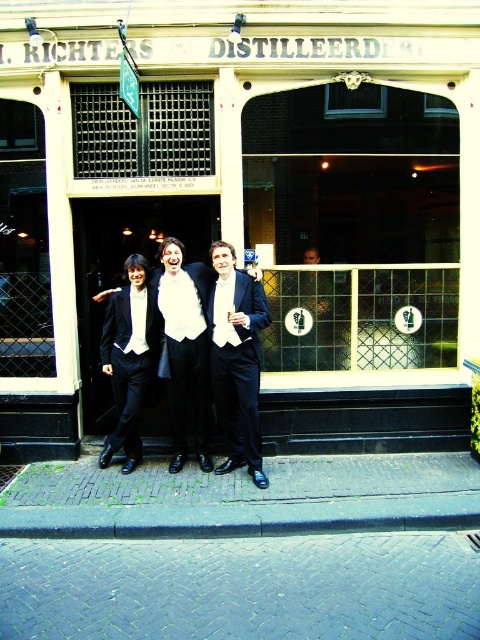
Question: Is shiny black suit at center smaller than matte black suit at center?

Choices:
 (A) no
 (B) yes

Answer: (A)

Question: Which point is farther from the camera taking this photo?

Choices:
 (A) (433, 164)
 (B) (230, 449)

Answer: (A)

Question: Does shiny black suit at center lie in front of matte black suit at center?

Choices:
 (A) yes
 (B) no

Answer: (A)

Question: Based on their relative distances, which object is nearer to the black satin suit at center?

Choices:
 (A) satin black tuxedo at center
 (B) matte black suit at center

Answer: (A)

Question: Can you confirm if satin black tuxedo at center is thinner than shiny black suit at center?

Choices:
 (A) yes
 (B) no

Answer: (B)

Question: Estimate the real-world distances between objects in this image. Which object is closer to the satin black tuxedo at center?

Choices:
 (A) black satin suit at center
 (B) shiny black suit at center
 (C) matte black glass at center

Answer: (A)